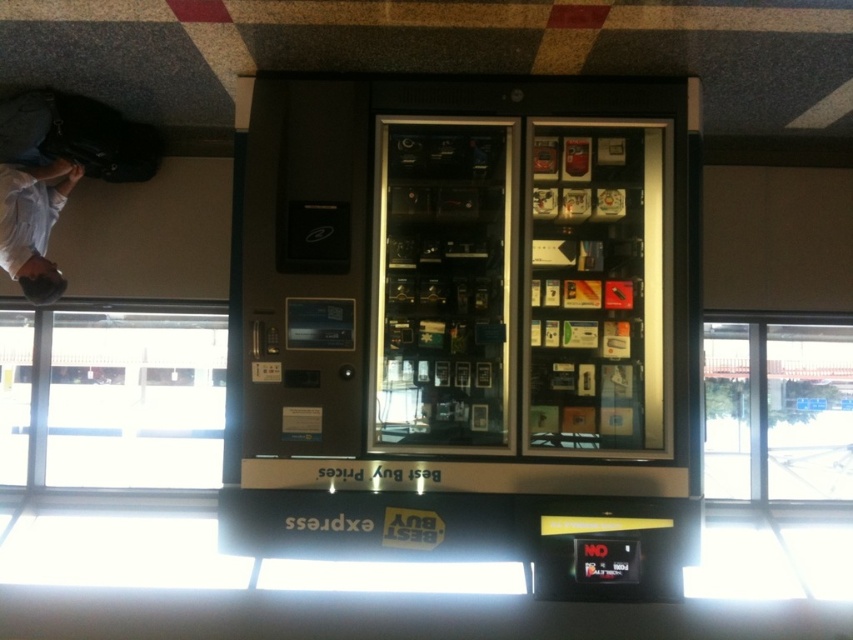
Is point (492, 493) positioned after point (39, 198)?

No, it is in front of (39, 198).

Which is in front, point (625, 316) or point (74, 182)?

Point (625, 316) is more forward.

Where is `metallic gray vending machine at center`? Image resolution: width=853 pixels, height=640 pixels. metallic gray vending machine at center is located at coordinates (468, 328).